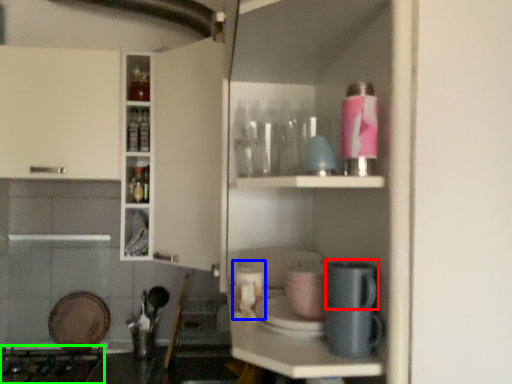
Question: Which is nearer to the appliance (highlighted by a red box)? appliance (highlighted by a blue box) or gas stove (highlighted by a green box).

Choices:
 (A) appliance
 (B) gas stove

Answer: (A)